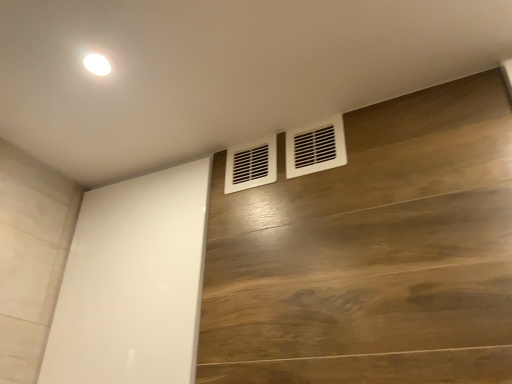
Question: Is point (298, 150) closer or farther from the camera than point (258, 172)?

Choices:
 (A) farther
 (B) closer

Answer: (A)

Question: Is white plastic vent at upper right, which is counted as the second air conditioning, starting from the left, to the left or to the right of white matte vent at center, the second air conditioning viewed from the right, in the image?

Choices:
 (A) left
 (B) right

Answer: (B)

Question: Based on their relative distances, which object is nearer to the white matte vent at center, the second air conditioning viewed from the right?

Choices:
 (A) white plastic vent at upper right, which is counted as the second air conditioning, starting from the left
 (B) white glossy screen door at center

Answer: (A)

Question: Which object is the farthest from the white glossy screen door at center?

Choices:
 (A) white matte vent at center, arranged as the first air conditioning when viewed from the left
 (B) white plastic vent at upper right, the first air conditioning when ordered from right to left

Answer: (B)